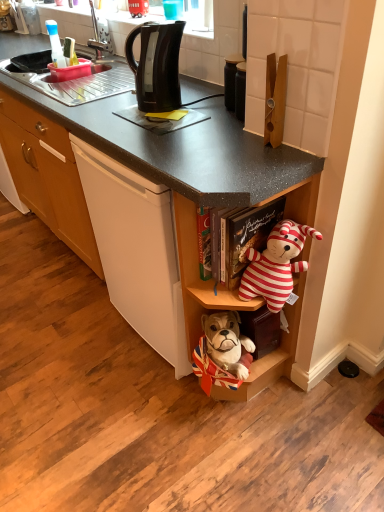
Locate an element on the screen. This screenshot has height=512, width=384. vacant space situated on the left part of black matte jar at upper center is located at coordinates (196, 106).